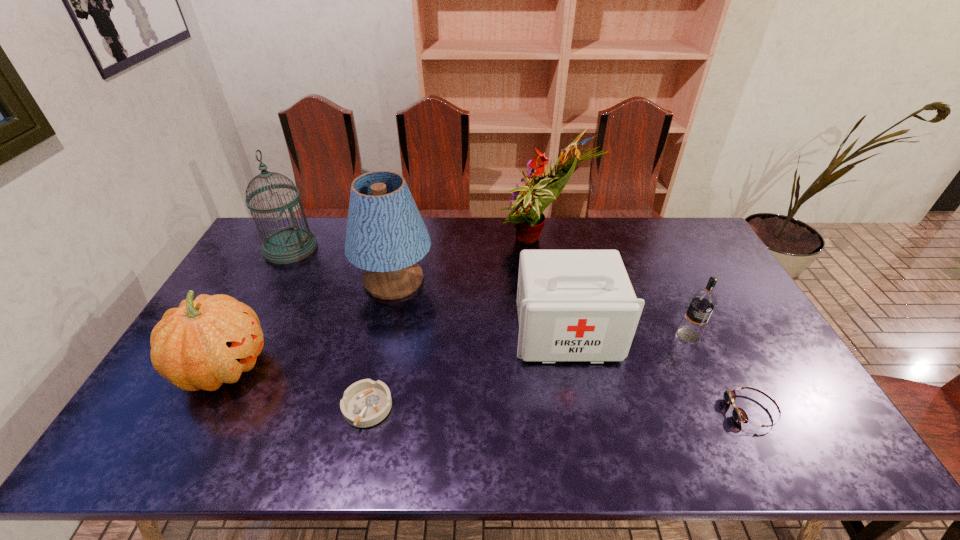
At what (x,y) coordinates should I click in order to perform the action: click on bouquet. Please return your answer as a coordinate pair (x, y). Looking at the image, I should click on (528, 202).

Locate an element on the screen. Image resolution: width=960 pixels, height=540 pixels. birdcage is located at coordinates (288, 245).

This screenshot has width=960, height=540. Identify the location of lampshade. (386, 236).

At what (x,y) coordinates should I click in order to perform the action: click on the first-aid kit. Please return your answer as a coordinate pair (x, y). This screenshot has height=540, width=960. Looking at the image, I should click on pyautogui.click(x=573, y=305).

The height and width of the screenshot is (540, 960). I want to click on pumpkin, so click(209, 341).

Where is `vodka`? vodka is located at coordinates (703, 302).

I want to click on goggles, so click(x=739, y=415).

Locate an element on the screen. ashtray is located at coordinates point(365,403).

Where is `vacant area located 0.090m on the front-facing side of the bouquet`? The image size is (960, 540). vacant area located 0.090m on the front-facing side of the bouquet is located at coordinates (469, 243).

Where is `free space located 0.290m on the front-facing side of the bouquet`? free space located 0.290m on the front-facing side of the bouquet is located at coordinates (415, 243).